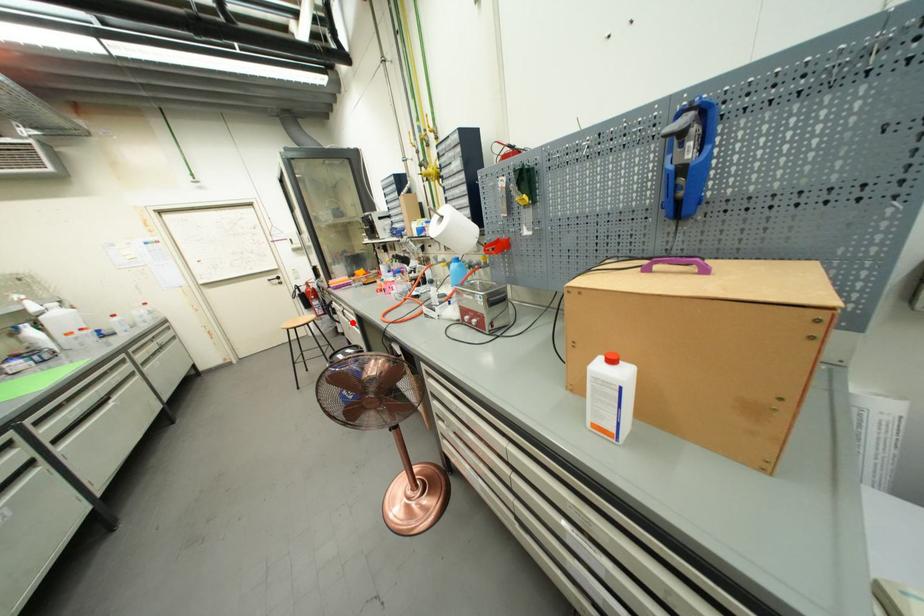
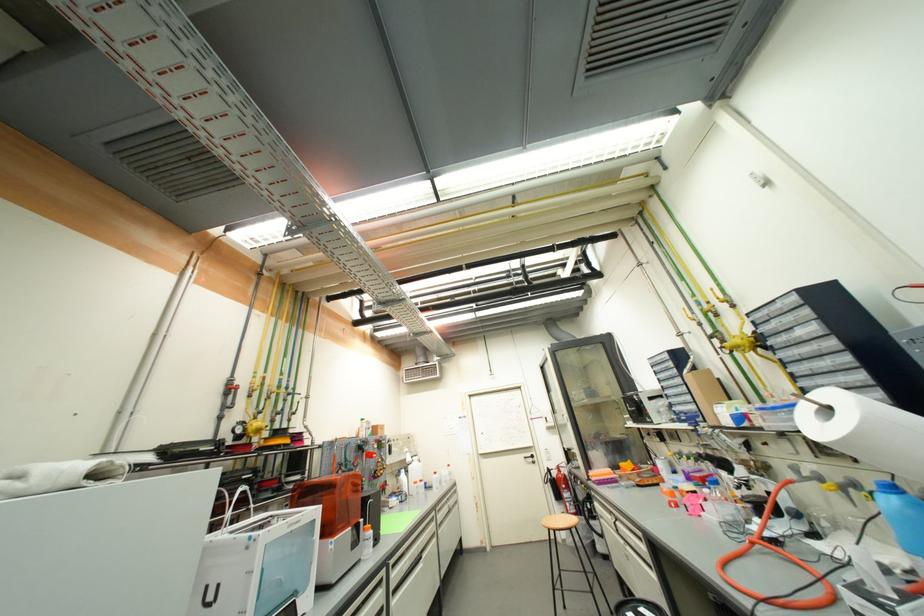
Question: I am providing you with two images of the same scene from different viewpoints. A red point is shown in image1. For the corresponding object point in image2, is it positioned nearer or farther from the camera?

Choices:
 (A) Nearer
 (B) Farther

Answer: (A)